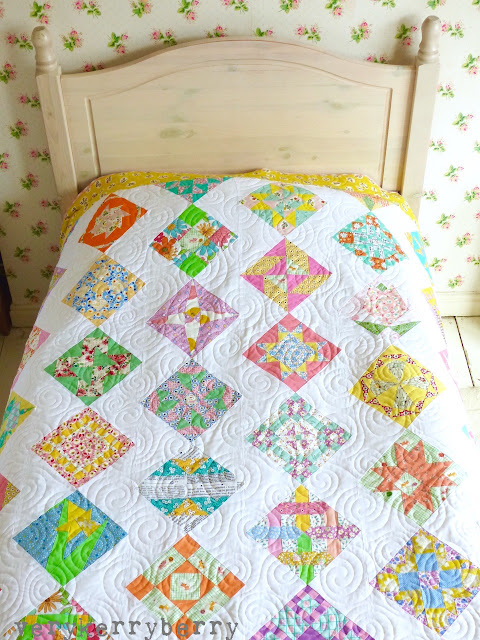
Where is `wall`? This screenshot has width=480, height=640. wall is located at coordinates (457, 182).